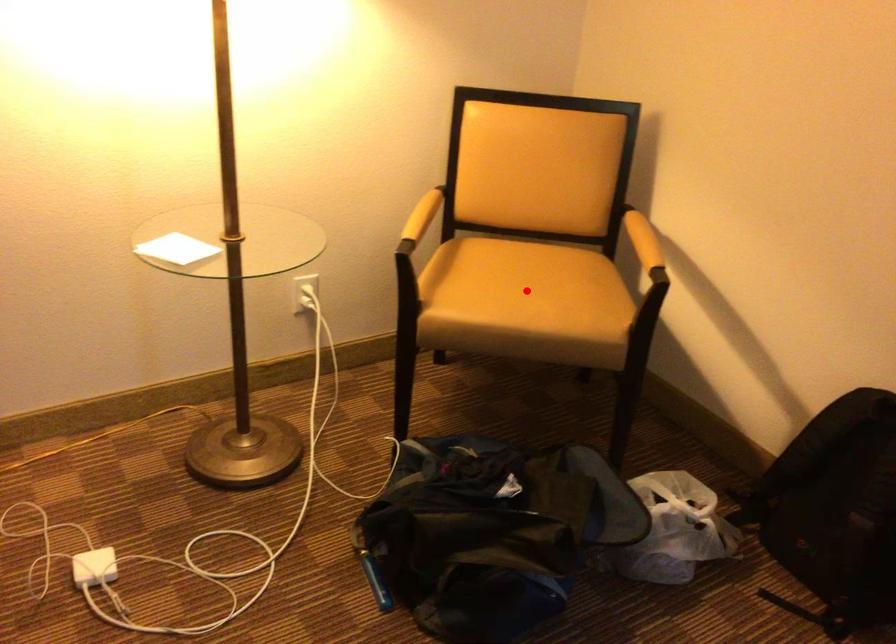
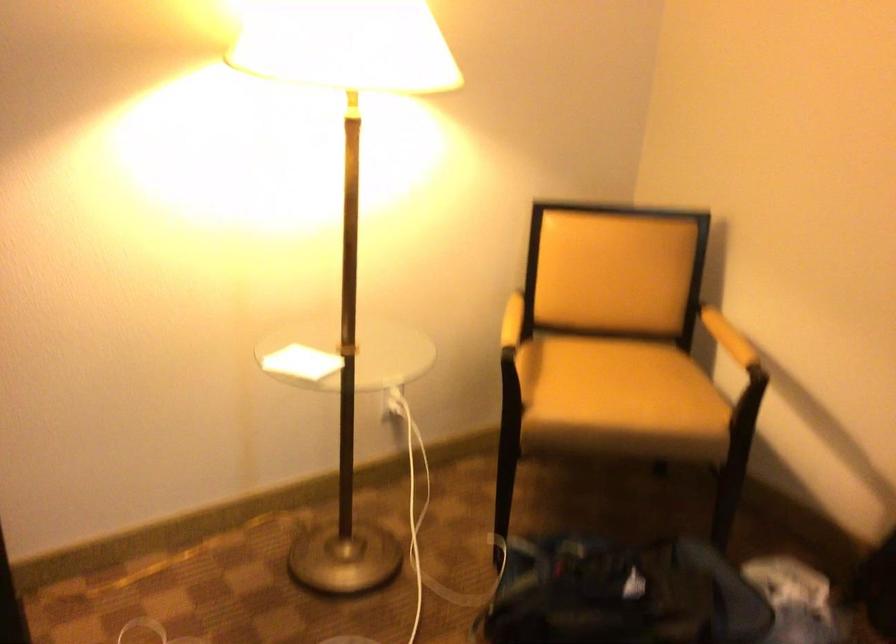
Locate, in the second image, the point that corresponds to the highlighted location in the first image.

(618, 388)